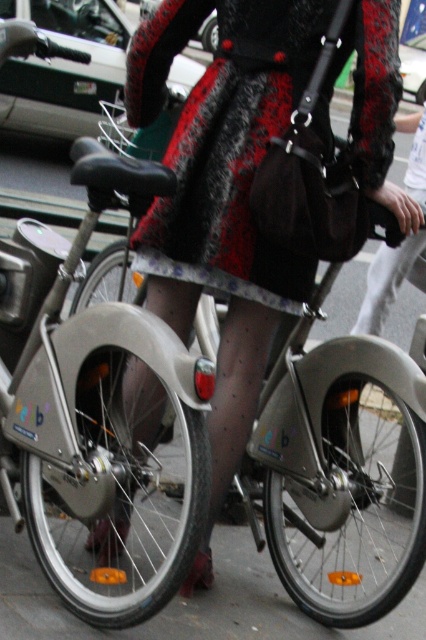
Question: Does black fuzzy coat at center appear under white sheer stocking at lower center?

Choices:
 (A) yes
 (B) no

Answer: (A)

Question: Considering the relative positions of velvet-like coat at center and black fuzzy coat at center in the image provided, where is velvet-like coat at center located with respect to black fuzzy coat at center?

Choices:
 (A) above
 (B) below

Answer: (B)

Question: Which point appears farthest from the camera in this image?

Choices:
 (A) (242, 150)
 (B) (419, 168)

Answer: (B)

Question: Which object is the closest to the velvet-like coat at center?

Choices:
 (A) black fuzzy coat at center
 (B) white sheer stocking at lower center

Answer: (A)

Question: Which point is closer to the camera?

Choices:
 (A) (210, 428)
 (B) (252, 92)
 (C) (422, 266)

Answer: (B)

Question: Does velvet-like coat at center come behind black fuzzy coat at center?

Choices:
 (A) yes
 (B) no

Answer: (B)